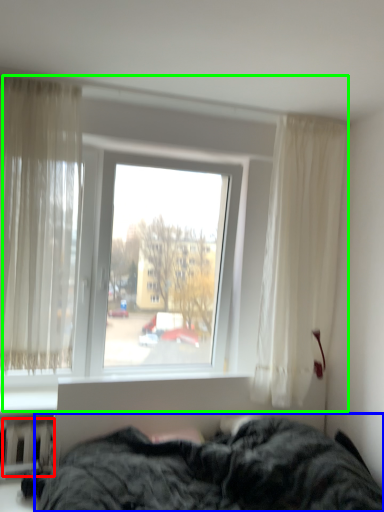
Question: Which is nearer to the radiator (highlighted by a red box)? bed (highlighted by a blue box) or window (highlighted by a green box).

Choices:
 (A) bed
 (B) window

Answer: (A)